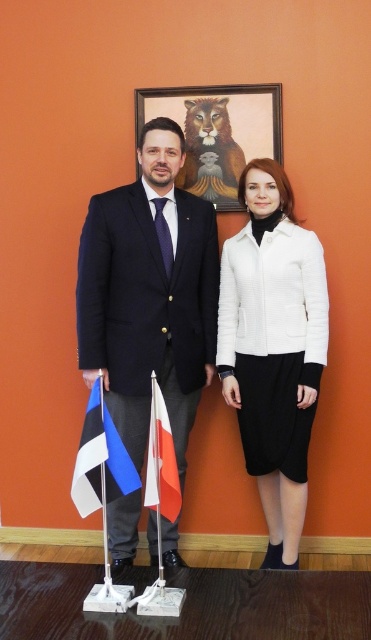
Question: Does blue and white fabric flag at lower left have a smaller size compared to white fabric flag at center?

Choices:
 (A) yes
 (B) no

Answer: (B)

Question: Which point appears farthest from the camera in this image?

Choices:
 (A) (270, 301)
 (B) (125, 216)

Answer: (A)

Question: Can you confirm if black suit at center is smaller than white fabric flag at center?

Choices:
 (A) yes
 (B) no

Answer: (B)

Question: Which of the following is the closest to the observer?

Choices:
 (A) white fabric flag at center
 (B) white textured jacket at center

Answer: (A)

Question: Is white textured jacket at center below blue and white fabric flag at lower left?

Choices:
 (A) yes
 (B) no

Answer: (B)

Question: Which of the following is the farthest from the observer?

Choices:
 (A) blue and white fabric flag at lower left
 (B) wooden frame at upper center
 (C) black suit at center
 (D) white fabric flag at center

Answer: (B)